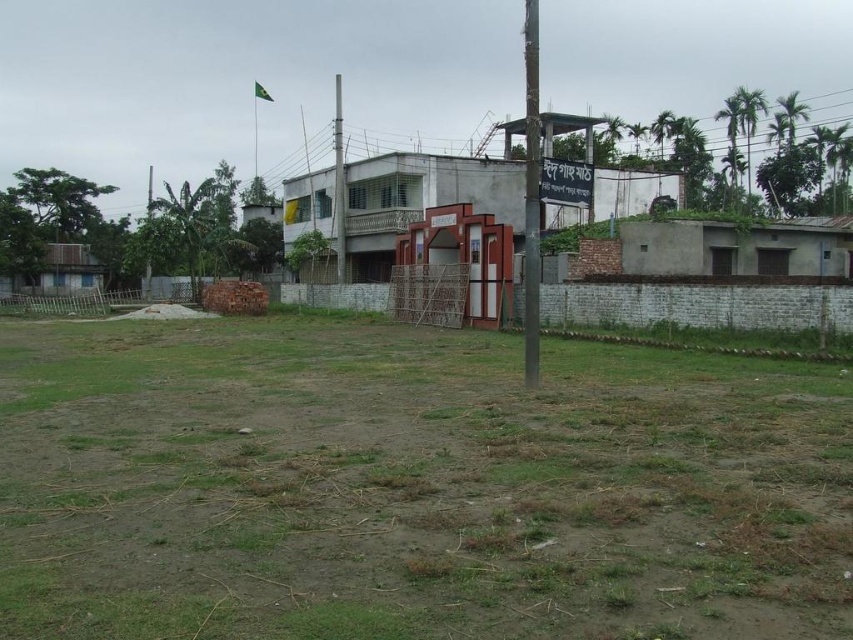
Question: Can you confirm if green grassy field at center is smaller than smooth metallic pole at center?

Choices:
 (A) yes
 (B) no

Answer: (A)

Question: Estimate the real-world distances between objects in this image. Which object is farther from the metallic pole at center?

Choices:
 (A) white plastic signboard at center
 (B) green grassy field at center
 (C) green fabric flag at upper center

Answer: (C)

Question: Which of these objects is positioned farthest from the metallic pole at center?

Choices:
 (A) smooth metallic pole at center
 (B) white plastic signboard at center
 (C) green fabric flag at upper center
 (D) green grassy field at center

Answer: (C)

Question: Can you confirm if green grassy field at center is wider than white plastic signboard at center?

Choices:
 (A) no
 (B) yes

Answer: (B)

Question: Can you confirm if metallic pole at center is wider than smooth metallic pole at center?

Choices:
 (A) yes
 (B) no

Answer: (A)

Question: Which point appears farthest from the camera in this image?

Choices:
 (A) (526, 12)
 (B) (556, 198)
 (C) (334, 100)

Answer: (C)